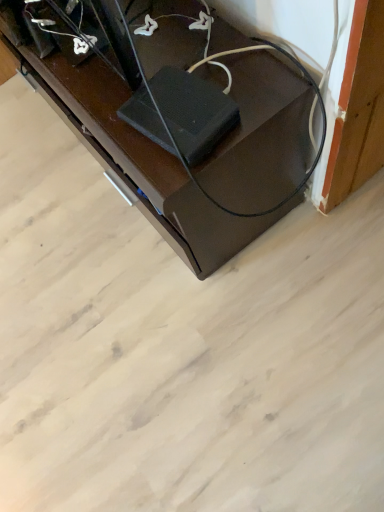
Question: Choose the correct answer: Is black glossy speaker at lower right inside black rubber speaker at center or outside it?

Choices:
 (A) outside
 (B) inside

Answer: (A)

Question: In the image, is black glossy speaker at lower right positioned in front of or behind black rubber speaker at center?

Choices:
 (A) behind
 (B) front

Answer: (A)

Question: Is black glossy speaker at lower right to the left or to the right of black rubber speaker at center in the image?

Choices:
 (A) right
 (B) left

Answer: (B)

Question: Is black rubber speaker at center inside or outside of black glossy speaker at lower right?

Choices:
 (A) inside
 (B) outside

Answer: (B)

Question: Considering their positions, is black rubber speaker at center located in front of or behind black glossy speaker at lower right?

Choices:
 (A) behind
 (B) front

Answer: (B)

Question: Based on their sizes in the image, would you say black rubber speaker at center is bigger or smaller than black glossy speaker at lower right?

Choices:
 (A) big
 (B) small

Answer: (B)

Question: From their relative heights in the image, would you say black rubber speaker at center is taller or shorter than black glossy speaker at lower right?

Choices:
 (A) tall
 (B) short

Answer: (B)